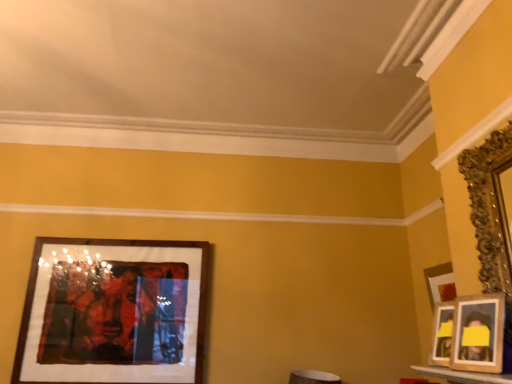
Question: Is wooden photo frame at right, which appears as the second picture frame when viewed from the front, further to the viewer compared to wooden frame at left, which is the 1th picture frame from left to right?

Choices:
 (A) no
 (B) yes

Answer: (A)

Question: Is wooden photo frame at right, the 2th picture frame positioned from the left, not within wooden frame at left, placed as the first picture frame when sorted from back to front?

Choices:
 (A) no
 (B) yes

Answer: (B)

Question: Can you confirm if wooden photo frame at right, positioned as the 2th picture frame in right-to-left order, is smaller than wooden frame at left, which is the 1th picture frame from left to right?

Choices:
 (A) no
 (B) yes

Answer: (B)

Question: Is wooden frame at left, placed as the first picture frame when sorted from back to front, completely or partially inside wooden photo frame at right, the 2th picture frame positioned from the left?

Choices:
 (A) no
 (B) yes

Answer: (A)

Question: From the image's perspective, is wooden photo frame at right, arranged as the 2th picture frame when viewed from the back, on top of wooden frame at left, placed as the 3th picture frame when sorted from right to left?

Choices:
 (A) yes
 (B) no

Answer: (A)

Question: Is wooden photo frame at right, the 2th picture frame positioned from the left, to the right of wooden frame at left, which is the 1th picture frame from left to right, from the viewer's perspective?

Choices:
 (A) yes
 (B) no

Answer: (A)

Question: Can you confirm if wooden frame at left, which is the 1th picture frame from left to right, is positioned to the right of wooden photo frame at right, which appears as the second picture frame when viewed from the front?

Choices:
 (A) no
 (B) yes

Answer: (A)

Question: Does wooden frame at left, placed as the 3th picture frame when sorted from right to left, come behind wooden photo frame at right, arranged as the 2th picture frame when viewed from the back?

Choices:
 (A) yes
 (B) no

Answer: (A)

Question: Is wooden frame at left, which is the 1th picture frame from left to right, oriented away from wooden photo frame at right, the 2th picture frame positioned from the left?

Choices:
 (A) no
 (B) yes

Answer: (A)

Question: Is wooden frame at left, placed as the first picture frame when sorted from back to front, oriented towards wooden photo frame at right, positioned as the 2th picture frame in right-to-left order?

Choices:
 (A) no
 (B) yes

Answer: (A)

Question: From the image's perspective, is wooden frame at left, placed as the first picture frame when sorted from back to front, on top of wooden photo frame at right, the 2th picture frame positioned from the left?

Choices:
 (A) yes
 (B) no

Answer: (B)

Question: Considering the relative sizes of wooden frame at left, placed as the first picture frame when sorted from back to front, and wooden photo frame at right, positioned as the 2th picture frame in right-to-left order, in the image provided, is wooden frame at left, placed as the first picture frame when sorted from back to front, shorter than wooden photo frame at right, positioned as the 2th picture frame in right-to-left order,?

Choices:
 (A) no
 (B) yes

Answer: (A)

Question: Is gold ornate mirror at right, which is counted as the third picture frame, starting from the left, far from wooden photo frame at right, arranged as the 2th picture frame when viewed from the back?

Choices:
 (A) yes
 (B) no

Answer: (B)